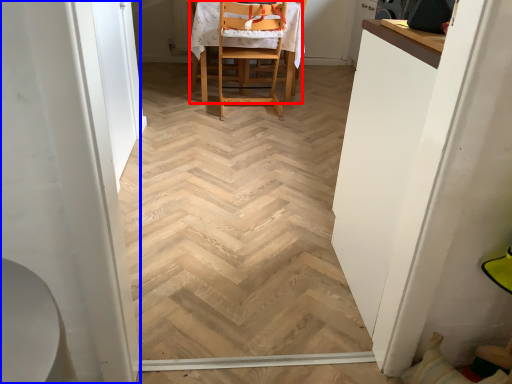
Question: Which point is further to the camera, chair (highlighted by a red box) or screen door (highlighted by a blue box)?

Choices:
 (A) chair
 (B) screen door

Answer: (A)